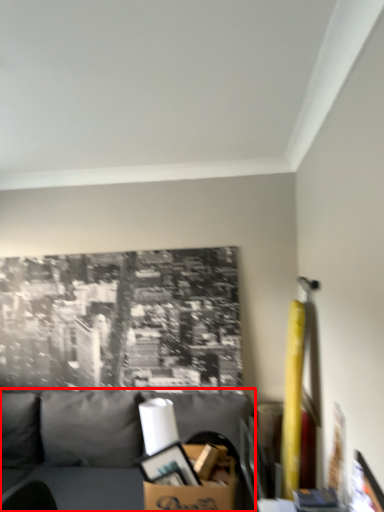
Question: In this image, where is studio couch (annotated by the red box) located relative to cardboard box?

Choices:
 (A) right
 (B) left

Answer: (B)